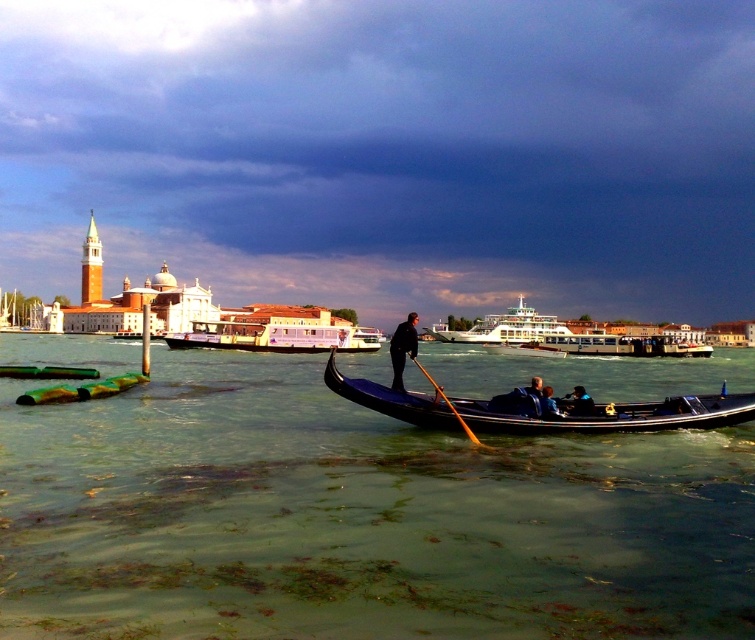
You are a tourist standing on the canal bridge and see the purple glossy ferry at center and the blue fabric jacket at center. Which object is higher from the water surface?

The purple glossy ferry at center is taller than the blue fabric jacket at center, so the purple glossy ferry at center is higher from the water surface.

You are a tourist on a gondola and notice two elements in the water. The green algae water at center and the dark blue fabric at center. Which one is positioned to the left when facing the direction the gondola is moving?

The green algae water at center is to the left of the dark blue fabric at center when facing the direction the gondola is moving.

You are a tourist standing on the canal bridge and see the purple glossy ferry at center and the blue fabric jacket at center. Which object is larger in size?

The purple glossy ferry at center is bigger than the blue fabric jacket at center.